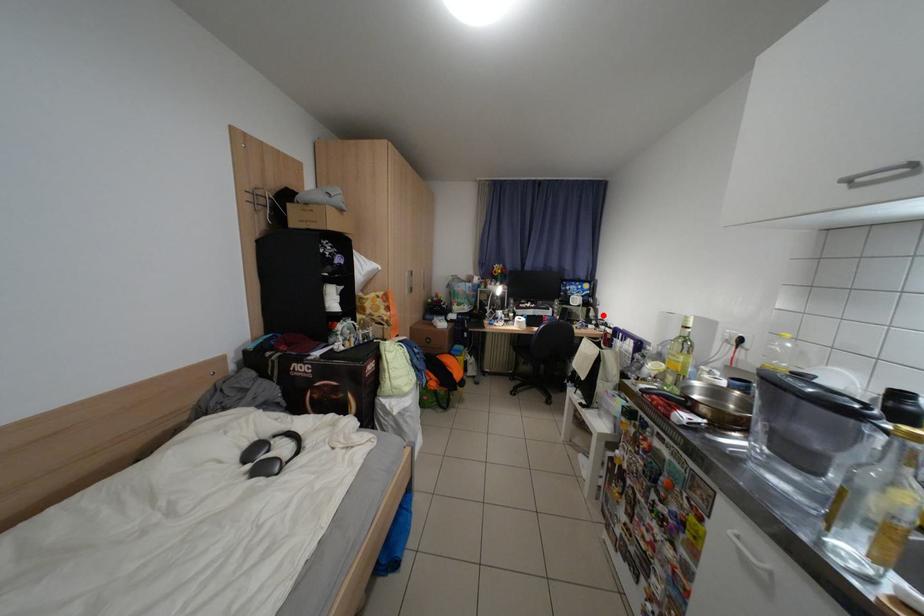
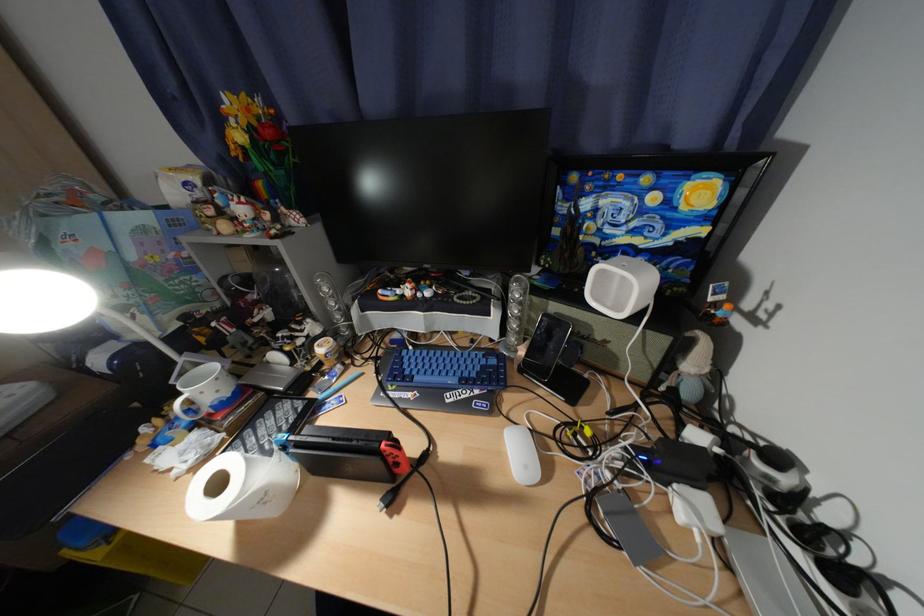
The point at the highlighted location is marked in the first image. Where is the corresponding point in the second image?

(704, 367)